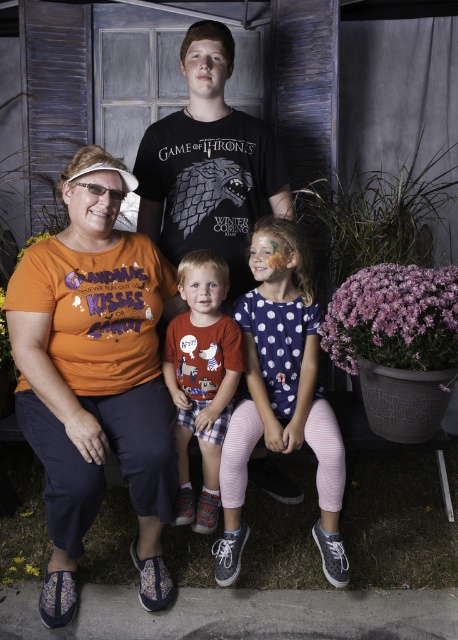
Question: Is polka dot fabric dress at center wider than black cotton t-shirt at center?

Choices:
 (A) yes
 (B) no

Answer: (B)

Question: Which point is closer to the camera?

Choices:
 (A) (65, 515)
 (B) (185, 266)

Answer: (A)

Question: Which point is closer to the camera?

Choices:
 (A) (271, 202)
 (B) (247, 532)

Answer: (B)

Question: Does orange fabric shirt at lower left come in front of polka dot fabric dress at center?

Choices:
 (A) no
 (B) yes

Answer: (B)

Question: Does orange fabric shirt at lower left lie behind black cotton t-shirt at center?

Choices:
 (A) no
 (B) yes

Answer: (A)

Question: Among these points, which one is nearest to the camera?

Choices:
 (A) pos(203,408)
 (B) pos(141,168)

Answer: (A)